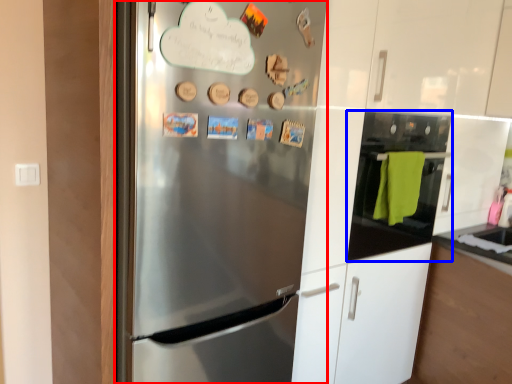
Question: Which point is further to the camera, refrigerator (highlighted by a red box) or oven (highlighted by a blue box)?

Choices:
 (A) refrigerator
 (B) oven

Answer: (B)